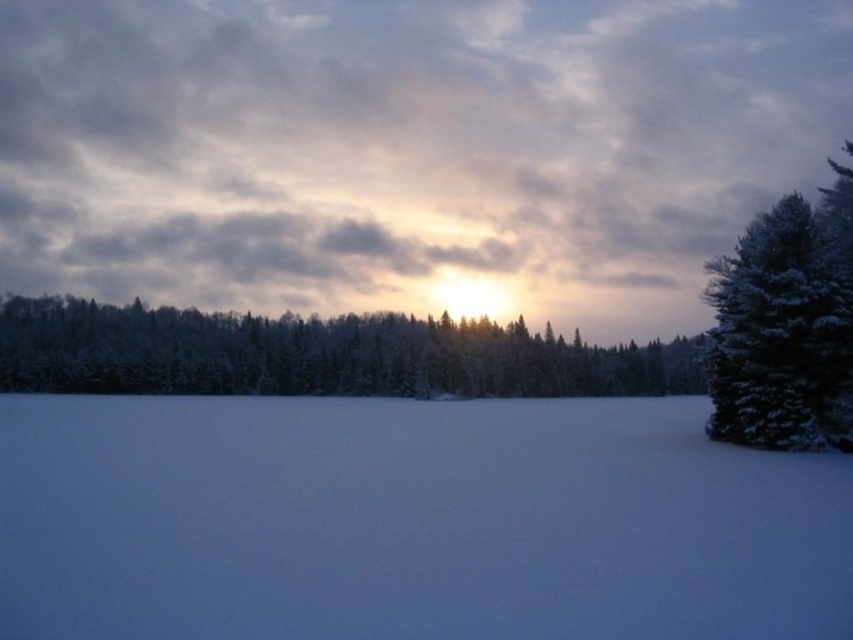
Question: Among these objects, which one is nearest to the camera?

Choices:
 (A) white powdery snow at lower center
 (B) snow-covered evergreen at right

Answer: (A)

Question: Is white powdery snow at lower center thinner than snow-covered evergreen at right?

Choices:
 (A) yes
 (B) no

Answer: (A)

Question: Can you confirm if white powdery snow at lower center is positioned below snow-covered evergreen at right?

Choices:
 (A) yes
 (B) no

Answer: (A)

Question: Which point is farther to the camera?

Choices:
 (A) (738, 417)
 (B) (605, 534)
 (C) (265, 321)

Answer: (C)

Question: Can you confirm if white powdery snow at lower center is positioned to the right of snow-covered evergreen trees at center?

Choices:
 (A) no
 (B) yes

Answer: (A)

Question: Estimate the real-world distances between objects in this image. Which object is closer to the snow-covered evergreen trees at center?

Choices:
 (A) white powdery snow at lower center
 (B) snow-covered evergreen at right

Answer: (A)